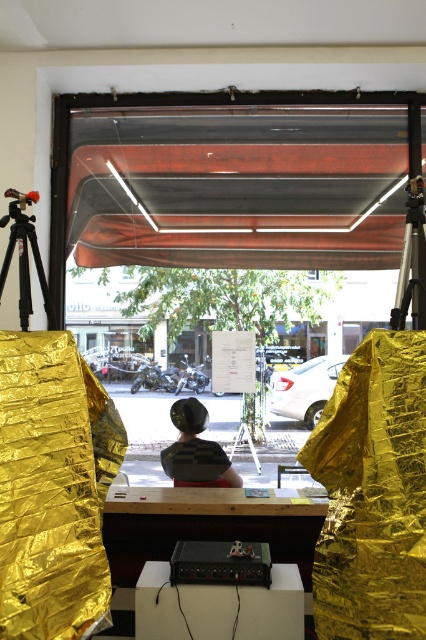
Which is more to the right, matte black tripod at left or silver metallic tripod at right?

From the viewer's perspective, silver metallic tripod at right appears more on the right side.

Who is more forward, (22, 216) or (409, 260)?

Point (22, 216) is more forward.

This screenshot has width=426, height=640. What do you see at coordinates (25, 257) in the screenshot?
I see `matte black tripod at left` at bounding box center [25, 257].

Locate an element on the screen. Image resolution: width=426 pixels, height=640 pixels. matte black tripod at left is located at coordinates (25, 257).

Measure the distance between white matte table at center and silver metallic tripod at right.

The distance of white matte table at center from silver metallic tripod at right is 1.48 meters.

Does white matte table at center appear under silver metallic tripod at right?

Yes.

In order to click on white matte table at center in this screenshot , I will do `click(218, 608)`.

Is wooden table at center below matte black tripod at left?

Yes.

Does point (271, 547) come in front of point (14, 218)?

That is False.

The image size is (426, 640). Identify the location of wooden table at center. (204, 525).